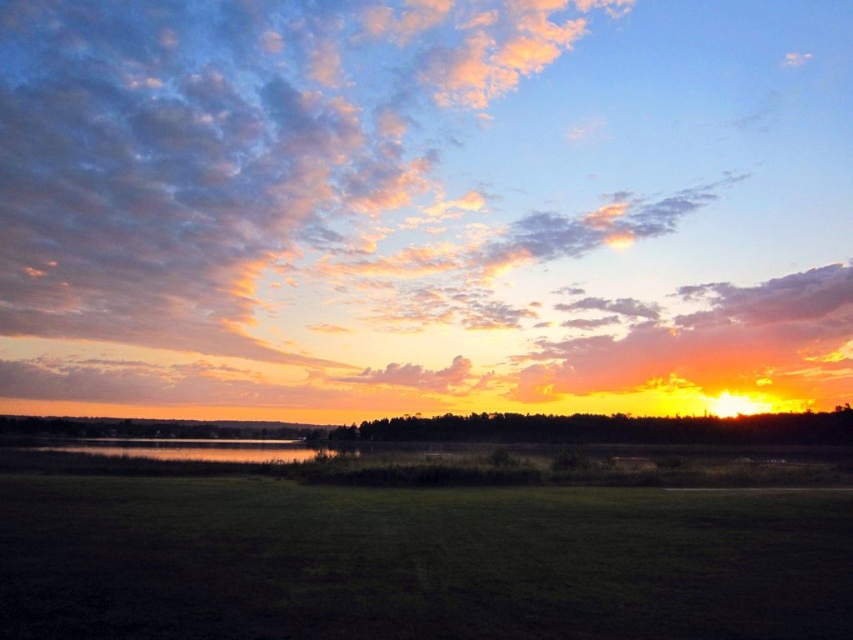
Question: Estimate the real-world distances between objects in this image. Which object is closer to the cloudy sky at upper center?

Choices:
 (A) green grass at lower center
 (B) glossy reflective water at center

Answer: (B)

Question: Can you confirm if cloudy sky at upper center is positioned below glossy reflective water at center?

Choices:
 (A) yes
 (B) no

Answer: (B)

Question: Is cloudy sky at upper center smaller than glossy reflective water at center?

Choices:
 (A) yes
 (B) no

Answer: (B)

Question: Considering the relative positions of green grass at lower center and glossy reflective water at center in the image provided, where is green grass at lower center located with respect to glossy reflective water at center?

Choices:
 (A) right
 (B) left

Answer: (A)

Question: Which of the following is the closest to the observer?

Choices:
 (A) cloudy sky at upper center
 (B) green grass at lower center

Answer: (B)

Question: Which point is farther from the camera taking this photo?

Choices:
 (A) (140, 102)
 (B) (486, 616)
 (C) (247, 460)

Answer: (A)